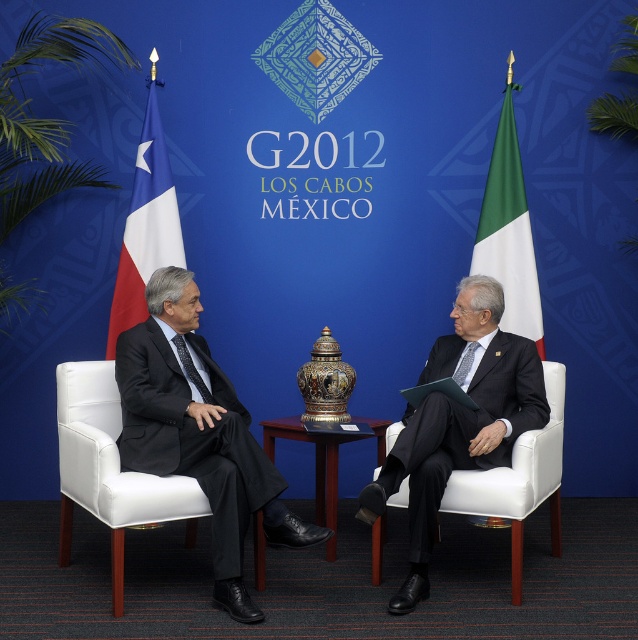
In the image of the G20 2012 summit meeting, there is a point at coordinate (198, 433). What object is located at that point?

The point at coordinate (198, 433) corresponds to the dark gray suit at left.

You are a photographer at the G20 2012 summit in Los Cabos, Mexico. You need to capture a photo of the dark gray suit at left and the shiny metallic table at center. Based on their sizes, which object will appear wider in the photo?

The dark gray suit at left will appear wider in the photo since its width is larger than that of the shiny metallic table at center.

You are a photographer at the G20 2012 summit in Los Cabos, Mexico. You need to capture a photo of the dark gray suit at left and the shiny metallic table at center. From the photographer perspective, which object is closer to the camera?

The dark gray suit at left is positioned over the shiny metallic table at center, so it appears closer to the camera.